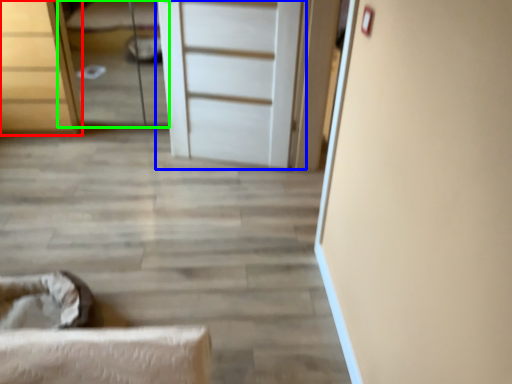
Question: Estimate the real-world distances between objects in this image. Which object is closer to chest of drawers (highlighted by a red box), door (highlighted by a blue box) or bed (highlighted by a green box)?

Choices:
 (A) door
 (B) bed

Answer: (B)